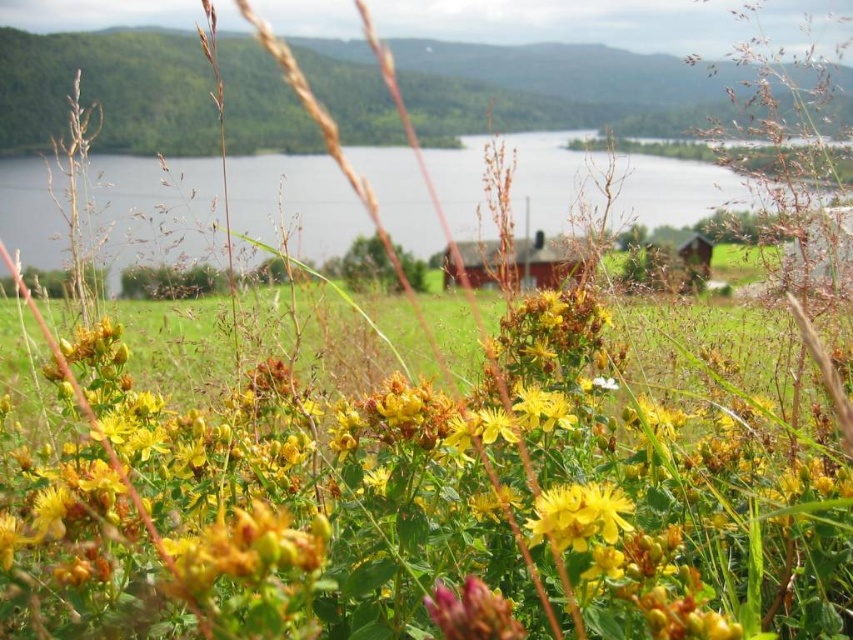
Question: Can you confirm if transparent water at center is positioned below purple matte flower at lower center?

Choices:
 (A) yes
 (B) no

Answer: (B)

Question: Does red wooden hut at center appear under purple matte flower at lower center?

Choices:
 (A) no
 (B) yes

Answer: (A)

Question: Which point is closer to the camera?

Choices:
 (A) (453, 612)
 (B) (730, 182)
 (C) (606, 513)
 (D) (419, 493)

Answer: (A)

Question: Which object is the farthest from the transparent water at center?

Choices:
 (A) purple matte flower at lower center
 (B) red wooden hut at center
 (C) yellow matte flower at center

Answer: (A)

Question: Does yellow matte flower at center appear on the right side of purple matte flower at lower center?

Choices:
 (A) yes
 (B) no

Answer: (A)

Question: Considering the real-world distances, which object is closest to the green leafy grass at center?

Choices:
 (A) purple matte flower at lower center
 (B) red wooden hut at center
 (C) yellow matte flower at center
 (D) transparent water at center

Answer: (C)